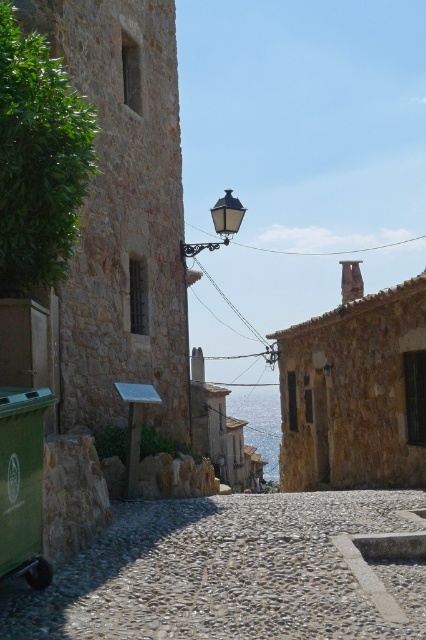
How much distance is there between blue water at center and black glass streetlamp at upper center?

blue water at center and black glass streetlamp at upper center are 320.24 meters apart from each other.

Does blue water at center appear on the right side of black glass streetlamp at upper center?

Indeed, blue water at center is positioned on the right side of black glass streetlamp at upper center.

This screenshot has width=426, height=640. What are the coordinates of `blue water at center` in the screenshot? It's located at (259, 422).

This screenshot has height=640, width=426. Find the location of `blue water at center`. blue water at center is located at coordinates (259, 422).

Is gray gravel alley at center to the left of blue water at center from the viewer's perspective?

Correct, you'll find gray gravel alley at center to the left of blue water at center.

Can you confirm if gray gravel alley at center is bigger than blue water at center?

No.

Which is in front, point (406, 593) or point (265, 428)?

Positioned in front is point (406, 593).

What are the coordinates of `gray gravel alley at center` in the screenshot? It's located at (226, 573).

Which of these two, gray gravel alley at center or black glass streetlamp at upper center, stands taller?

black glass streetlamp at upper center is taller.

Is gray gravel alley at center further to camera compared to black glass streetlamp at upper center?

No, gray gravel alley at center is in front of black glass streetlamp at upper center.

What are the coordinates of `gray gravel alley at center` in the screenshot? It's located at (226, 573).